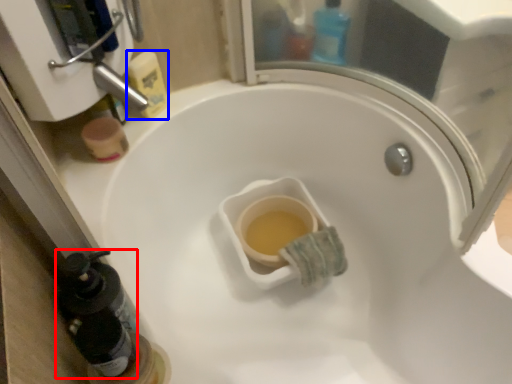
Question: Which object is further to the camera taking this photo, bottle (highlighted by a red box) or cleaning product (highlighted by a blue box)?

Choices:
 (A) bottle
 (B) cleaning product

Answer: (B)